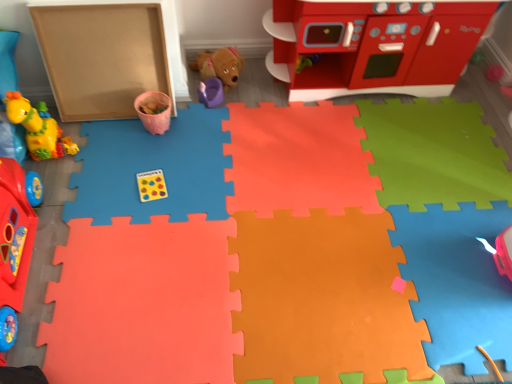
I want to click on free space in front of brown plush dog at center, positioned as the third toy in right-to-left order, so click(218, 115).